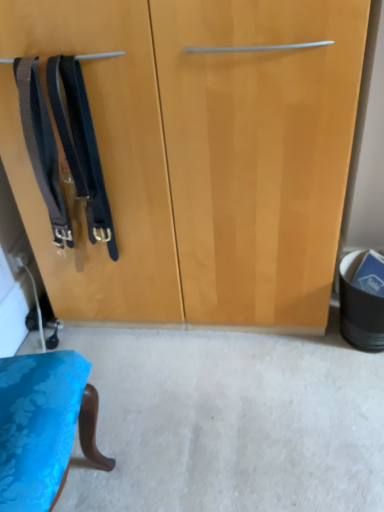
What are the coordinates of `black matte suspenders at left, which is the 1th suspenders in right-to-left order` in the screenshot? It's located at pos(80,146).

The image size is (384, 512). What do you see at coordinates (80, 146) in the screenshot? I see `black matte suspenders at left, the 2th suspenders positioned from the left` at bounding box center [80, 146].

How much space does black leather suspenders at left, which is the second suspenders in right-to-left order, occupy horizontally?

6.08 inches.

Measure the distance between point (56, 223) and camera.

Point (56, 223) and camera are 4.37 feet apart from each other.

The height and width of the screenshot is (512, 384). Describe the element at coordinates (42, 146) in the screenshot. I see `black leather suspenders at left, which is the second suspenders in right-to-left order` at that location.

Find the location of a particular element. black leather suspenders at left, which is the second suspenders in right-to-left order is located at coordinates (42, 146).

You are a GUI agent. You are given a task and a screenshot of the screen. Output one action in this format:
    pyautogui.click(x=<x>, y=<y>)
    Task: Click on the black matte suspenders at left, which is the 1th suspenders in right-to-left order
    
    Given the screenshot: What is the action you would take?
    pyautogui.click(x=80, y=146)

Considering the relative positions of black matte suspenders at left, the 2th suspenders positioned from the left, and black leather suspenders at left, which is the second suspenders in right-to-left order, in the image provided, is black matte suspenders at left, the 2th suspenders positioned from the left, to the left of black leather suspenders at left, which is the second suspenders in right-to-left order, from the viewer's perspective?

No.

Which object is further away from the camera taking this photo, black matte suspenders at left, the 2th suspenders positioned from the left, or black leather suspenders at left, which is the second suspenders in right-to-left order?

black leather suspenders at left, which is the second suspenders in right-to-left order, is more distant.

Which is closer, (x=55, y=73) or (x=32, y=161)?

Clearly, point (x=55, y=73) is closer to the camera than point (x=32, y=161).

From the image's perspective, is black matte suspenders at left, which is the 1th suspenders in right-to-left order, below black leather suspenders at left, which is the second suspenders in right-to-left order?

Correct, black matte suspenders at left, which is the 1th suspenders in right-to-left order, appears lower than black leather suspenders at left, which is the second suspenders in right-to-left order, in the image.

From a real-world perspective, which is physically above, black matte suspenders at left, which is the 1th suspenders in right-to-left order, or black leather suspenders at left, which is the second suspenders in right-to-left order?

From a 3D spatial view, black leather suspenders at left, which is the second suspenders in right-to-left order, is above.

Which object is thinner, black matte suspenders at left, the 2th suspenders positioned from the left, or black leather suspenders at left, which is the second suspenders in right-to-left order?

With smaller width is black leather suspenders at left, which is the second suspenders in right-to-left order.

Considering the sizes of black matte suspenders at left, the 2th suspenders positioned from the left, and black leather suspenders at left, positioned as the 1th suspenders in left-to-right order, in the image, is black matte suspenders at left, the 2th suspenders positioned from the left, taller or shorter than black leather suspenders at left, positioned as the 1th suspenders in left-to-right order,?

Clearly, black matte suspenders at left, the 2th suspenders positioned from the left, is taller compared to black leather suspenders at left, positioned as the 1th suspenders in left-to-right order.

Is black matte suspenders at left, the 2th suspenders positioned from the left, smaller than black leather suspenders at left, which is the second suspenders in right-to-left order?

Incorrect, black matte suspenders at left, the 2th suspenders positioned from the left, is not smaller in size than black leather suspenders at left, which is the second suspenders in right-to-left order.

Could black leather suspenders at left, positioned as the 1th suspenders in left-to-right order, be considered to be inside black matte suspenders at left, the 2th suspenders positioned from the left?

No.

Is black matte suspenders at left, the 2th suspenders positioned from the left, not close to black leather suspenders at left, which is the second suspenders in right-to-left order?

No, there isn't a large distance between black matte suspenders at left, the 2th suspenders positioned from the left, and black leather suspenders at left, which is the second suspenders in right-to-left order.

Is black matte suspenders at left, the 2th suspenders positioned from the left, turned away from black leather suspenders at left, positioned as the 1th suspenders in left-to-right order?

→ No, black matte suspenders at left, the 2th suspenders positioned from the left, is not facing the opposite direction of black leather suspenders at left, positioned as the 1th suspenders in left-to-right order.

Can you tell me how much black matte suspenders at left, which is the 1th suspenders in right-to-left order, and black leather suspenders at left, positioned as the 1th suspenders in left-to-right order, differ in facing direction?

0.00186 degrees separate the facing orientations of black matte suspenders at left, which is the 1th suspenders in right-to-left order, and black leather suspenders at left, positioned as the 1th suspenders in left-to-right order.

Locate an element on the screen. suspenders behind the black matte suspenders at left, which is the 1th suspenders in right-to-left order is located at coordinates (42, 146).

Between black leather suspenders at left, which is the second suspenders in right-to-left order, and black matte suspenders at left, the 2th suspenders positioned from the left, which one appears on the right side from the viewer's perspective?

Positioned to the right is black matte suspenders at left, the 2th suspenders positioned from the left.

Which object is more forward, black leather suspenders at left, which is the second suspenders in right-to-left order, or black matte suspenders at left, which is the 1th suspenders in right-to-left order?

black matte suspenders at left, which is the 1th suspenders in right-to-left order, is closer to the camera.

Is point (37, 162) positioned in front of point (55, 98)?

No.

Looking at this image, from the image's perspective, between black leather suspenders at left, positioned as the 1th suspenders in left-to-right order, and black matte suspenders at left, which is the 1th suspenders in right-to-left order, which one is located above?

black leather suspenders at left, positioned as the 1th suspenders in left-to-right order.

From a real-world perspective, is black leather suspenders at left, which is the second suspenders in right-to-left order, physically below black matte suspenders at left, the 2th suspenders positioned from the left?

Incorrect, from a real-world perspective, black leather suspenders at left, which is the second suspenders in right-to-left order, is higher than black matte suspenders at left, the 2th suspenders positioned from the left.

Considering the sizes of black leather suspenders at left, which is the second suspenders in right-to-left order, and black matte suspenders at left, which is the 1th suspenders in right-to-left order, in the image, is black leather suspenders at left, which is the second suspenders in right-to-left order, wider or thinner than black matte suspenders at left, which is the 1th suspenders in right-to-left order,?

In the image, black leather suspenders at left, which is the second suspenders in right-to-left order, appears to be more narrow than black matte suspenders at left, which is the 1th suspenders in right-to-left order.

Is black leather suspenders at left, positioned as the 1th suspenders in left-to-right order, shorter than black matte suspenders at left, the 2th suspenders positioned from the left?

Yes.

Between black leather suspenders at left, which is the second suspenders in right-to-left order, and black matte suspenders at left, which is the 1th suspenders in right-to-left order, which one has larger size?

With larger size is black matte suspenders at left, which is the 1th suspenders in right-to-left order.

Is black leather suspenders at left, positioned as the 1th suspenders in left-to-right order, surrounding black matte suspenders at left, the 2th suspenders positioned from the left?

Actually, black matte suspenders at left, the 2th suspenders positioned from the left, is outside black leather suspenders at left, positioned as the 1th suspenders in left-to-right order.

Is black leather suspenders at left, positioned as the 1th suspenders in left-to-right order, far from black matte suspenders at left, the 2th suspenders positioned from the left?

No, black leather suspenders at left, positioned as the 1th suspenders in left-to-right order, is in close proximity to black matte suspenders at left, the 2th suspenders positioned from the left.

Consider the image. Is black leather suspenders at left, which is the second suspenders in right-to-left order, facing towards black matte suspenders at left, which is the 1th suspenders in right-to-left order?

No, black leather suspenders at left, which is the second suspenders in right-to-left order, is not oriented towards black matte suspenders at left, which is the 1th suspenders in right-to-left order.

Looking at this image, how many degrees apart are the facing directions of black leather suspenders at left, which is the second suspenders in right-to-left order, and black matte suspenders at left, the 2th suspenders positioned from the left?

They differ by 0.00186 degrees in their facing directions.

How far apart are black leather suspenders at left, which is the second suspenders in right-to-left order, and black matte suspenders at left, which is the 1th suspenders in right-to-left order?

black leather suspenders at left, which is the second suspenders in right-to-left order, and black matte suspenders at left, which is the 1th suspenders in right-to-left order, are 3.07 inches apart.

Where is `suspenders on the left of the black matte suspenders at left, which is the 1th suspenders in right-to-left order`? suspenders on the left of the black matte suspenders at left, which is the 1th suspenders in right-to-left order is located at coordinates (42, 146).

Locate an element on the screen. Image resolution: width=384 pixels, height=512 pixels. suspenders on the right of black leather suspenders at left, which is the second suspenders in right-to-left order is located at coordinates (80, 146).

At what (x,y) coordinates should I click in order to perform the action: click on suspenders below the black leather suspenders at left, which is the second suspenders in right-to-left order (from the image's perspective). Please return your answer as a coordinate pair (x, y). This screenshot has height=512, width=384. Looking at the image, I should click on (80, 146).